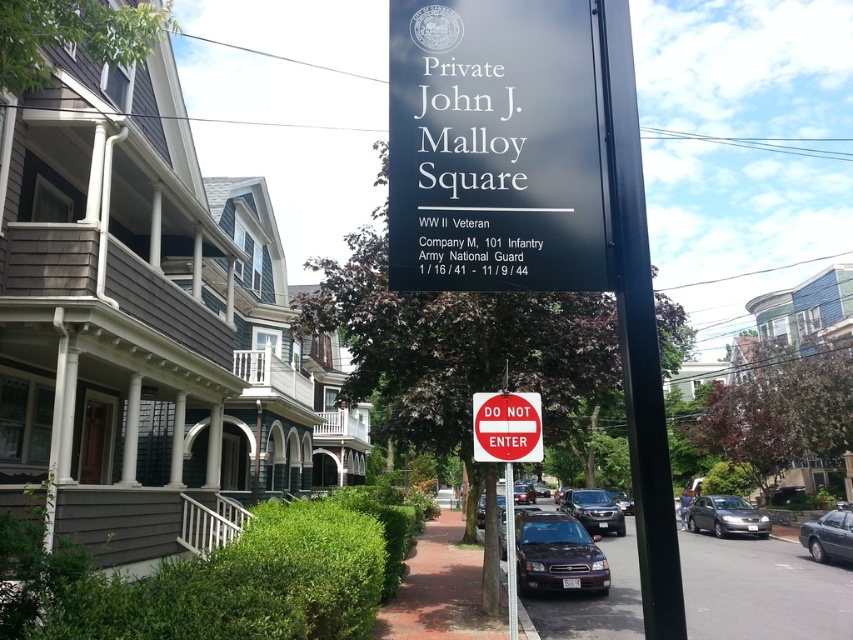
You are standing at the camera position and want to take a photo of the matte gray sedan at center. Given that the camera has a focal length of 50mm and the sedan is 72.04 feet away, what is the approximate angle of view required to capture the entire sedan in the frame?

The angle of view required to capture the entire matte gray sedan at center would depend on the camera sensor size and the sedan dimensions. However, with a 50mm lens at 72.04 feet distance, the field of view is roughly 46 degrees diagonally, which may vary based on the camera type.

You are a delivery driver who needs to park your 4.5 meter long truck in this area. You see a satin black sedan at center and a satin black suv at center. Which vehicle should you park behind to ensure enough space for your truck?

The satin black sedan at center is shorter than the satin black suv at center, so parking behind the sedan would leave more space for the truck.

You are a delivery driver who needs to park your truck, which is 2 meters wide, near the red plastic sign at center. Can you park your truck next to the shiny black sedan at center without overlapping them?

The red plastic sign at center has a lesser width compared to the shiny black sedan at center. Since the truck is 2 meters wide and the sedan is wider than the sign, there might be enough space, but the exact width of the sedan isn